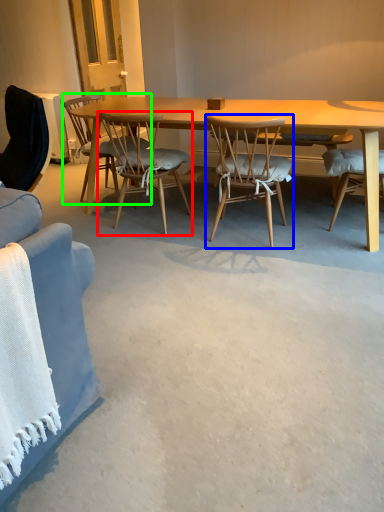
Question: Which is nearer to the chair (highlighted by a red box)? chair (highlighted by a blue box) or chair (highlighted by a green box).

Choices:
 (A) chair
 (B) chair

Answer: (B)